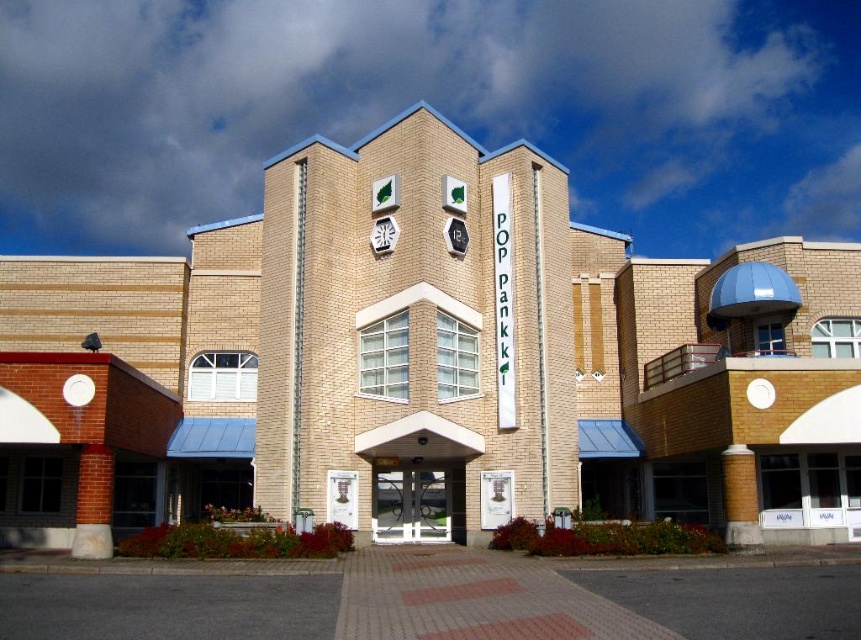
You are standing at the point marked as point [375,224]. You want to walk to the nearest entrance of the building. The building has two hexagonal clock faces. Which direction should you walk to reach the entrance closest to the lower clock face?

Walk towards the building towards the lower clock face since the entrance closest to it is nearest to point [375,224].